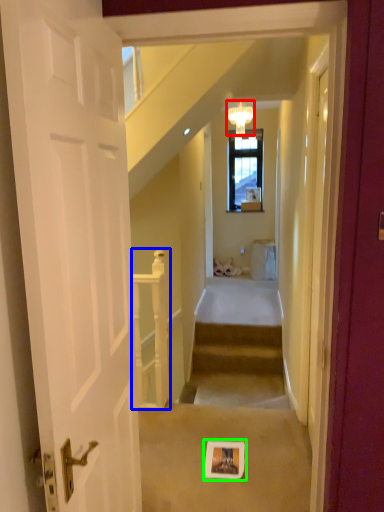
Question: Which is farther away from light fixture (highlighted by a red box)? rail (highlighted by a blue box) or picture frame (highlighted by a green box)?

Choices:
 (A) rail
 (B) picture frame

Answer: (B)